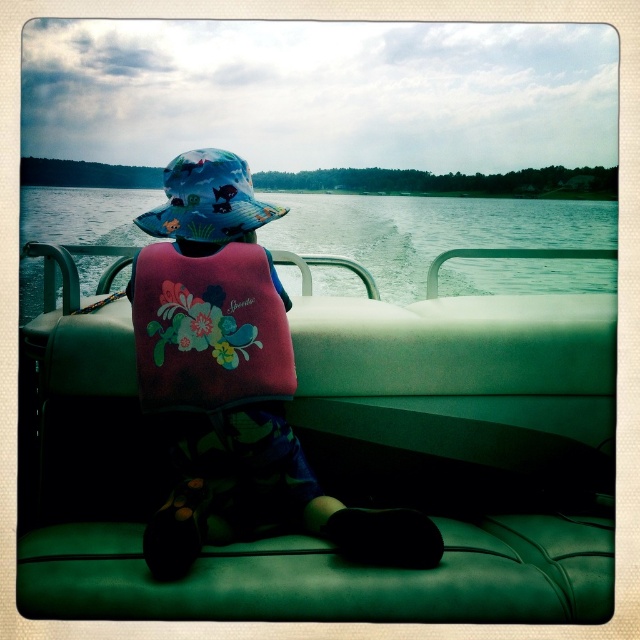
You are a safety inspector checking the boat for proper equipment. You notice two life vests at the center of the boat. One is labeled as a floral fleece life vest and the other as a floral fabric life jacket. According to safety regulations, the life vest must be wider than the life jacket. Does the floral fleece life vest at center meet the requirement compared to the floral fabric life jacket at center?

The floral fleece life vest at center has a greater width than the floral fabric life jacket at center, so it meets the requirement of being wider than the life jacket.

Looking at this image, you are a photographer trying to capture the child on the boat. You want to position yourself so that the floral fleece life vest at center and the green water at center are both visible in your shot. Based on their positions, which object should you focus on first to ensure both are in frame?

The floral fleece life vest at center is to the left of green water at center, so you should focus on the floral fleece life vest at center first to ensure both are in frame.